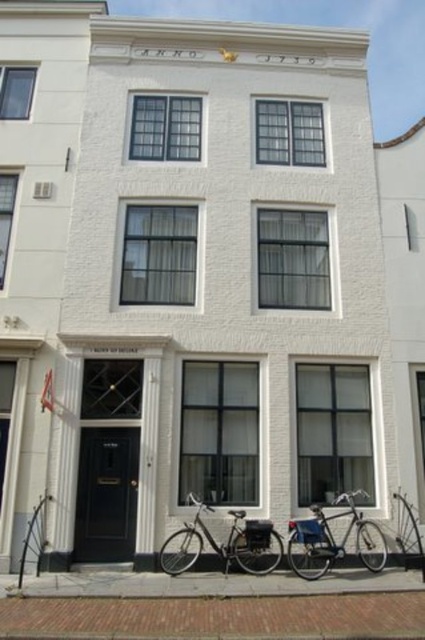
Which is more to the left, shiny silver bicycle at lower center or shiny metallic bicycle at lower center?

From the viewer's perspective, shiny silver bicycle at lower center appears more on the left side.

Is point (249, 556) positioned behind point (374, 544)?

No.

Is point (159, 561) closer to camera compared to point (319, 524)?

That is True.

Find the location of `shiny silver bicycle at lower center`. shiny silver bicycle at lower center is located at coordinates [223, 544].